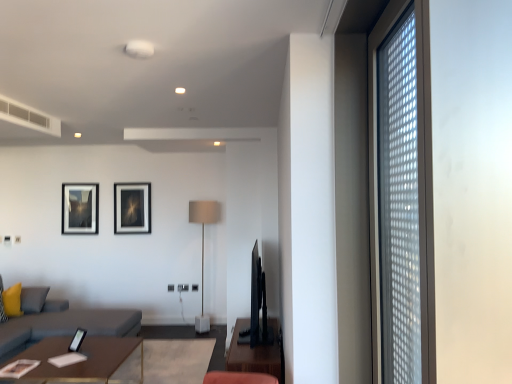
You are a GUI agent. You are given a task and a screenshot of the screen. Output one action in this format:
    pyautogui.click(x=<x>, y=<y>)
    Task: Click on the vacant area located to the right-hand side of matte black picture frame at lower center, the 1th picture frame from the front
    Image resolution: width=512 pixels, height=384 pixels.
    Given the screenshot: What is the action you would take?
    (95, 345)